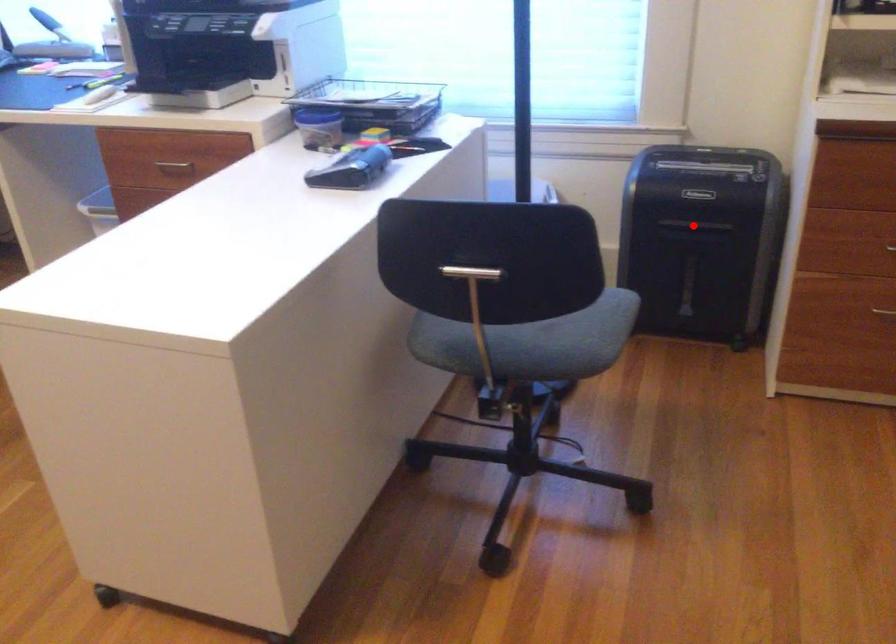
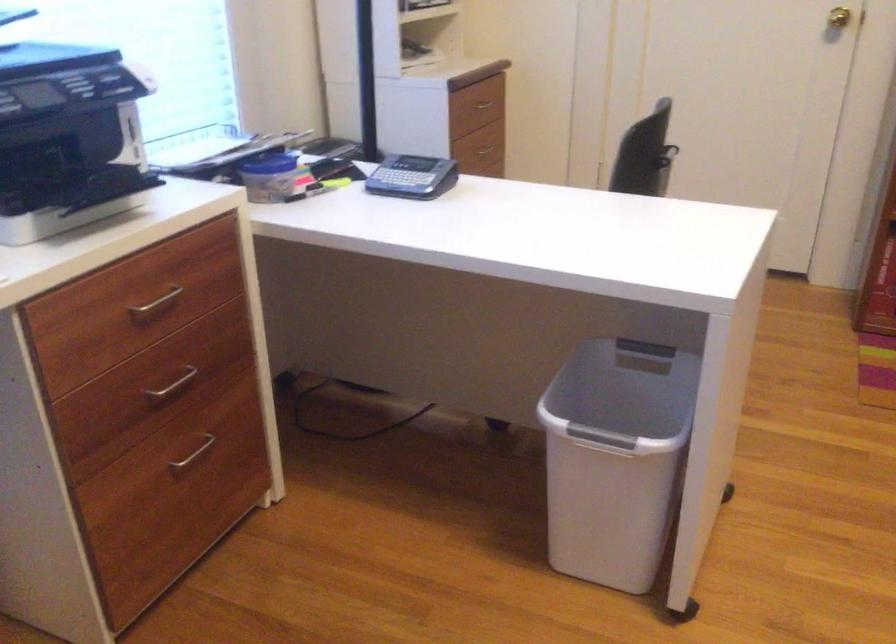
Question: I am providing you with two images of the same scene from different viewpoints. A red point is marked on the first image. At the location where the point appears in image 1, is it still visible in image 2?

Choices:
 (A) Yes
 (B) No

Answer: (B)